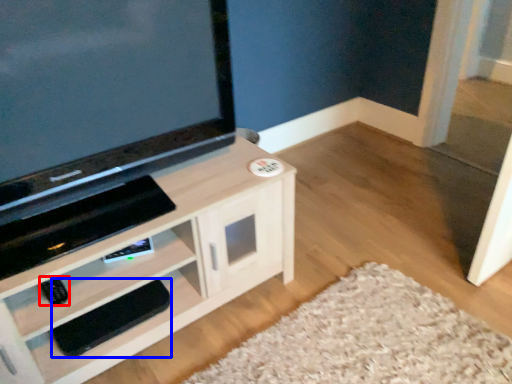
Question: Among these objects, which one is nearest to the camera, remote (highlighted by a red box) or footrest (highlighted by a blue box)?

Choices:
 (A) remote
 (B) footrest

Answer: (A)